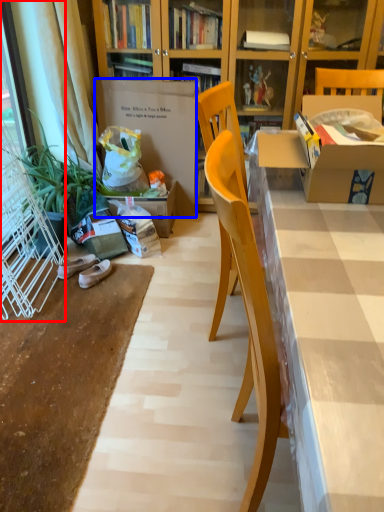
Question: Among these objects, which one is nearest to the camera, screen door (highlighted by a red box) or cardboard box (highlighted by a blue box)?

Choices:
 (A) screen door
 (B) cardboard box

Answer: (A)